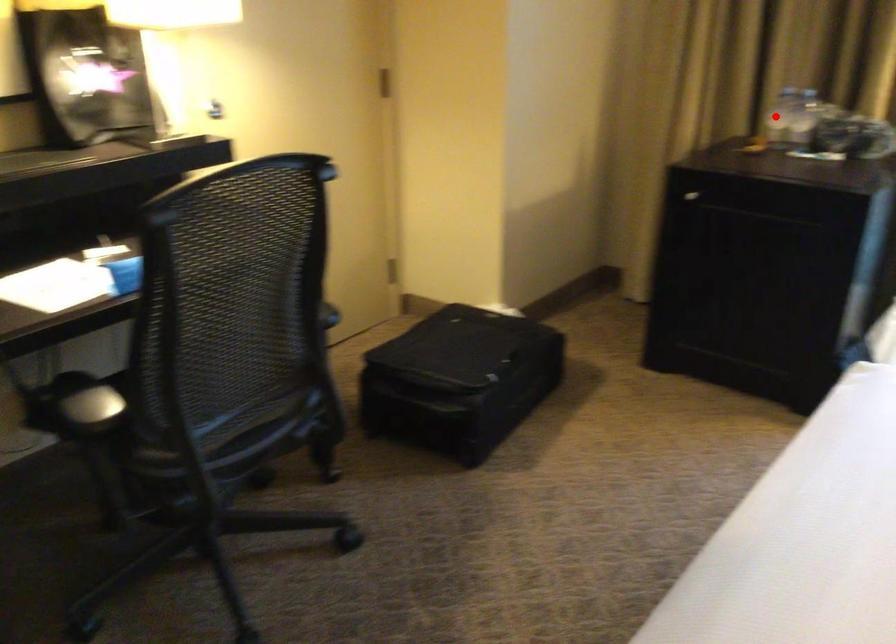
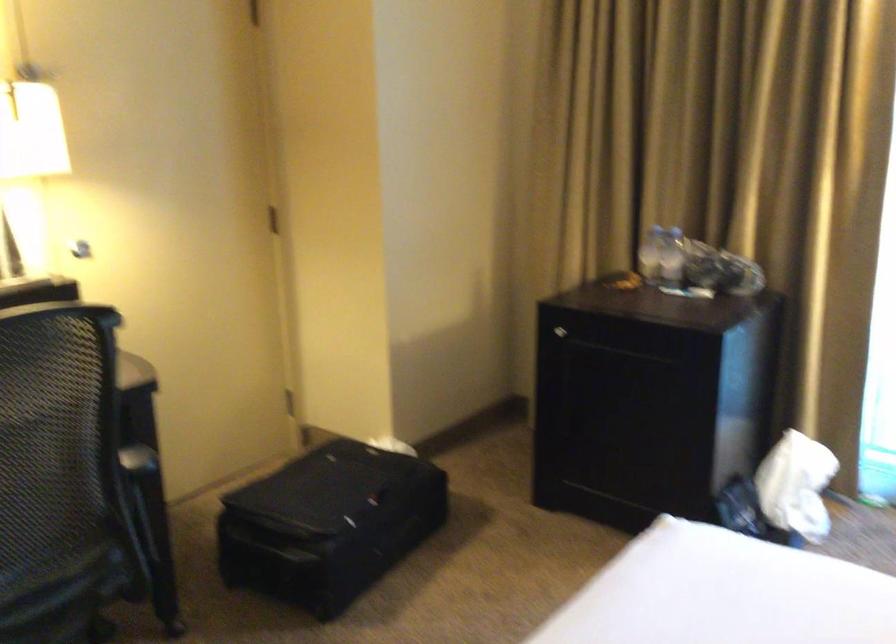
In the second image, find the point that corresponds to the highlighted location in the first image.

(650, 252)